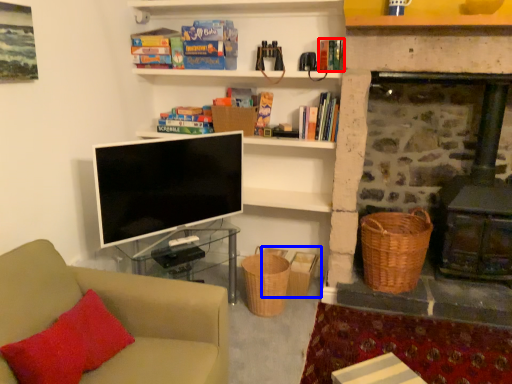
Question: Which of the following is the farthest to the observer, book (highlighted by a red box) or basket (highlighted by a blue box)?

Choices:
 (A) book
 (B) basket

Answer: (B)